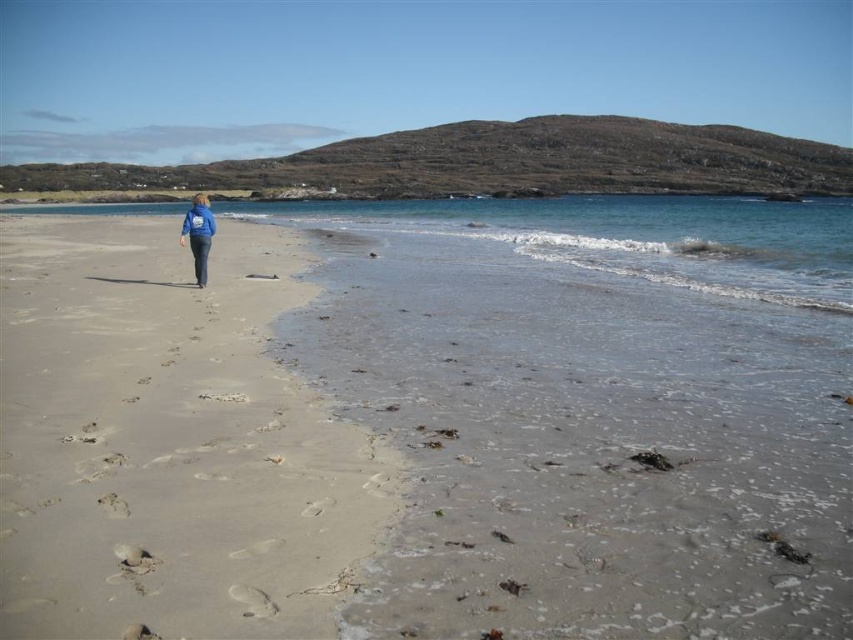
You are standing on the beach and see two points marked on the sand. The first point is at coordinates point (289, 412) and the second is at point (200, 276). If you are facing the water, which point is closer to you?

Point (289, 412) is in front of point (200, 276), so if you are facing the water, the point (289, 412) is closer to you.

Consider the image. You are standing on the beach and see the light beige sand at left and the blue fabric jacket at center. Which object is closer to your feet?

The light beige sand at left is closer to your feet because it is located below the blue fabric jacket at center, meaning it is lower in position.